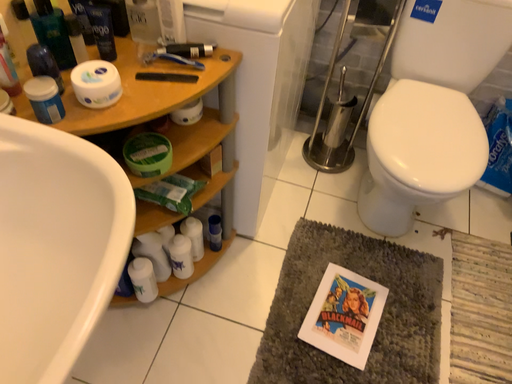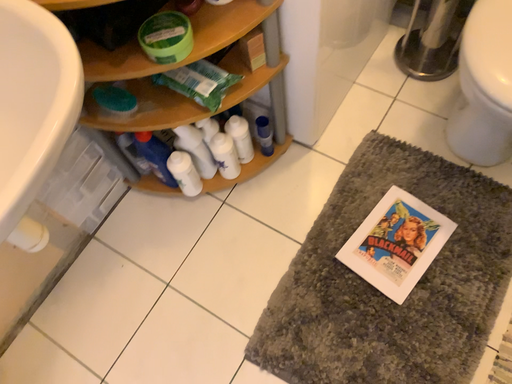
Question: How did the camera likely rotate when shooting the video?

Choices:
 (A) rotated left
 (B) rotated right

Answer: (A)